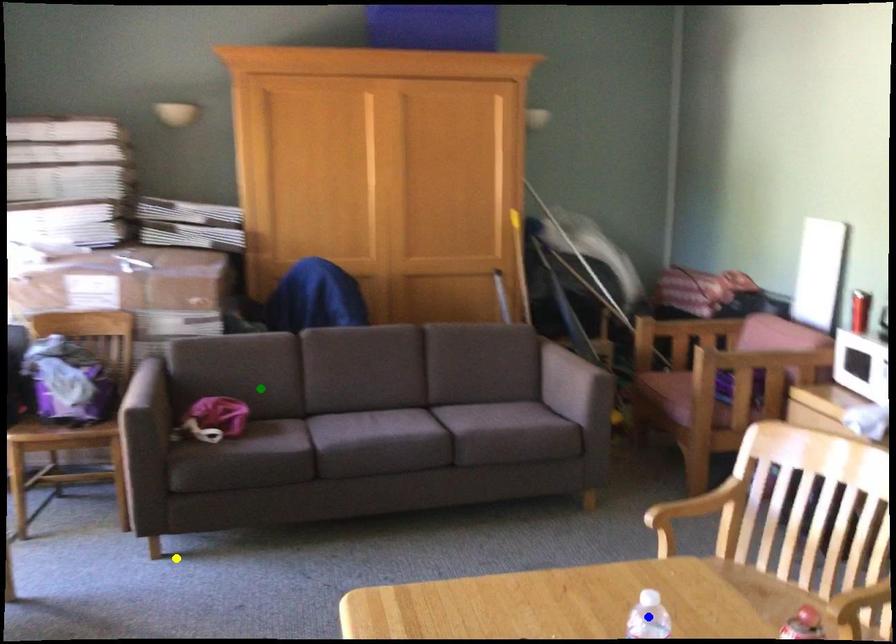
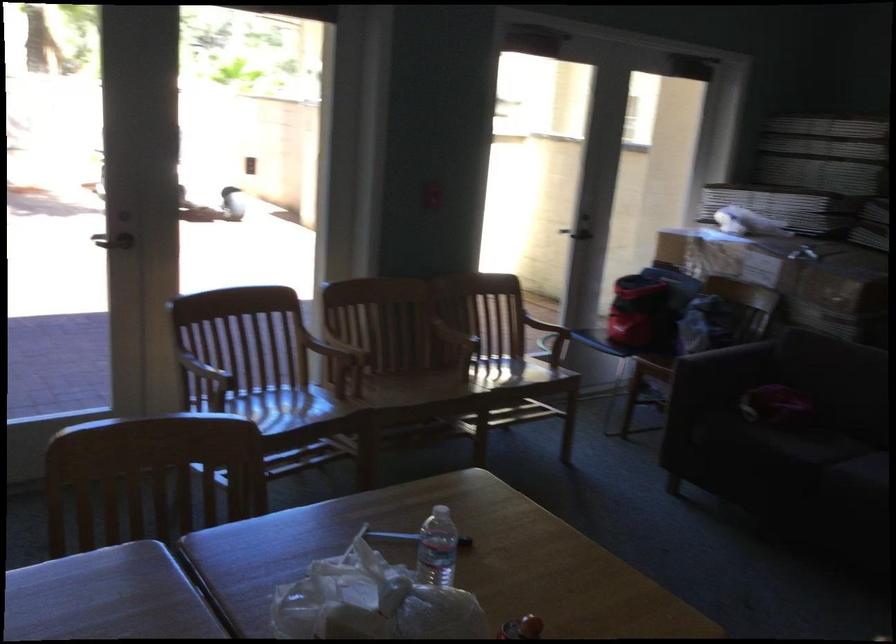
I am providing you with two images of the same scene from different viewpoints. Three points are marked in image1. Which point corresponds to a part or object that is occluded in image2?In image1, three points are marked. Which of them correspond to a part or object that is occluded in image2?Among the three points shown in image1, which one corresponds to a part or object that is no longer visible due to occlusion in image2?

Invisible in image2: blue point.